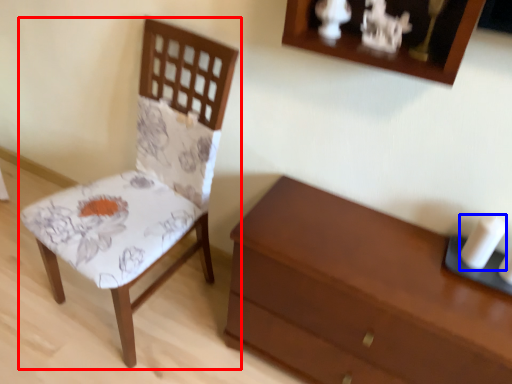
Question: Among these objects, which one is farthest to the camera, chair (highlighted by a red box) or candle (highlighted by a blue box)?

Choices:
 (A) chair
 (B) candle

Answer: (B)